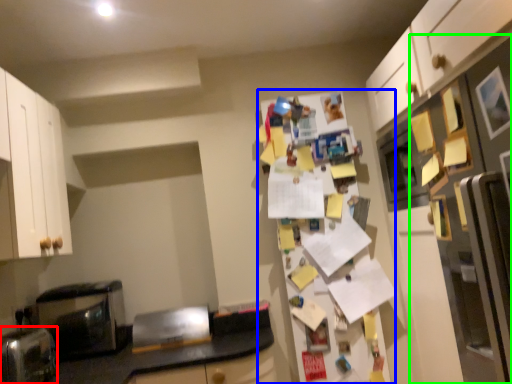
Question: Which object is positioned closest to appliance (highlighted by a red box)? Select from fridge (highlighted by a blue box) and fridge (highlighted by a green box).

Choices:
 (A) fridge
 (B) fridge

Answer: (A)